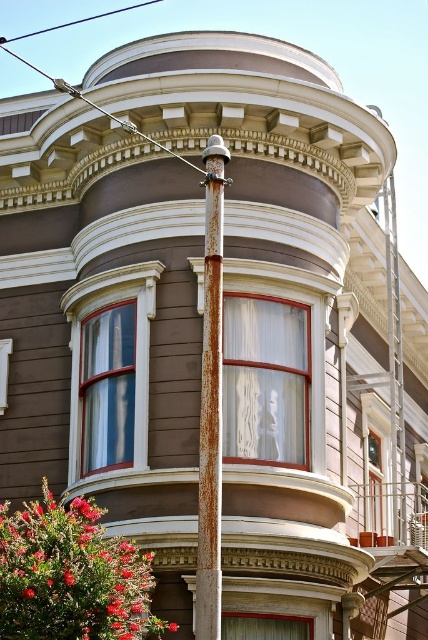
Can you confirm if rusty metal pole at center is thinner than blue wire at upper center?

Correct, rusty metal pole at center's width is less than blue wire at upper center's.

In the scene shown: Can you confirm if rusty metal pole at center is shorter than blue wire at upper center?

No.

Who is more forward, (196, 577) or (14, 38)?

Positioned in front is point (196, 577).

This screenshot has height=640, width=428. I want to click on rusty metal pole at center, so click(211, 401).